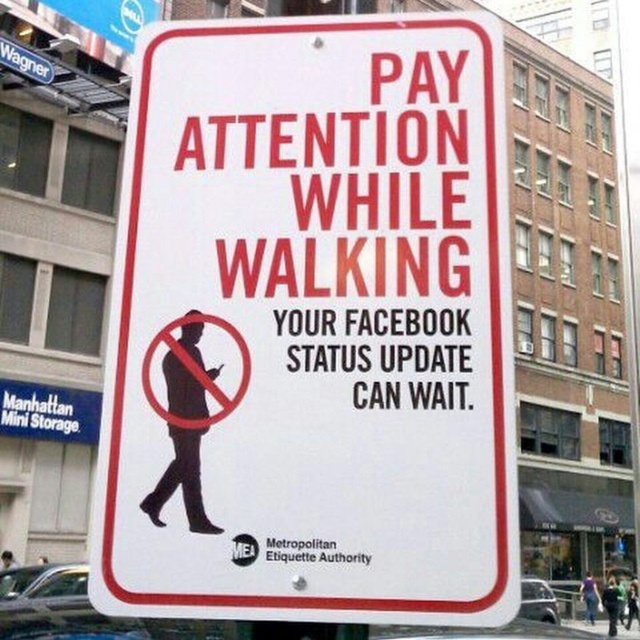
Question: Which point is closer to the camera?

Choices:
 (A) white plastic sign at upper left
 (B) white paper sign at center

Answer: (B)

Question: Does white paper sign at center come behind white plastic sign at upper left?

Choices:
 (A) yes
 (B) no

Answer: (B)

Question: Which point is farther to the camera?

Choices:
 (A) white paper sign at center
 (B) white plastic sign at upper left

Answer: (B)

Question: Does white paper sign at center appear over white plastic sign at upper left?

Choices:
 (A) no
 (B) yes

Answer: (A)

Question: Does white paper sign at center appear on the left side of white plastic sign at upper left?

Choices:
 (A) no
 (B) yes

Answer: (A)